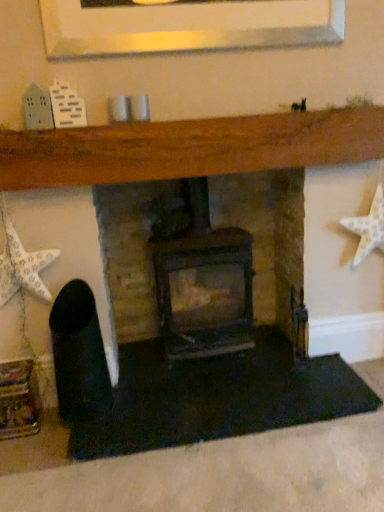
You are a GUI agent. You are given a task and a screenshot of the screen. Output one action in this format:
    pyautogui.click(x=<x>, y=<y>)
    Task: Click on the free space in front of dark brown wood burning stove at center
    The image size is (384, 512).
    Given the screenshot: What is the action you would take?
    tap(220, 412)